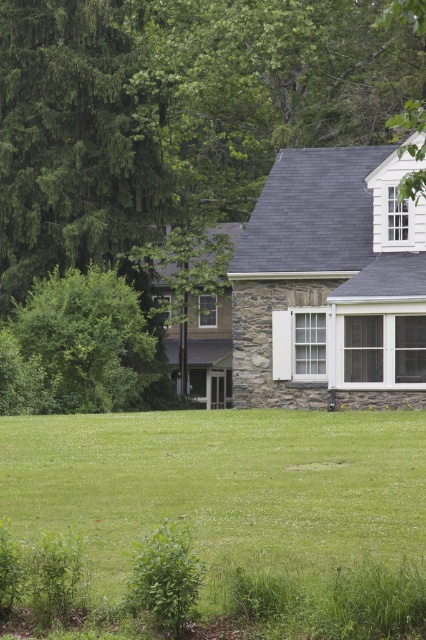
Who is higher up, green leafy tree at upper left or green grass at center?

green leafy tree at upper left is higher up.

Between point (238, 156) and point (284, 442), which one is positioned in front?

Point (284, 442) is in front.

Where is `green leafy tree at upper left`? This screenshot has height=640, width=426. green leafy tree at upper left is located at coordinates 173,118.

Is green leafy tree at upper left taller than green leafy bush at left?

Correct, green leafy tree at upper left is much taller as green leafy bush at left.

Which of these two, green leafy tree at upper left or green leafy bush at left, stands taller?

With more height is green leafy tree at upper left.

Is point (77, 99) farther from viewer compared to point (103, 275)?

Yes, it is behind point (103, 275).

Where is `green leafy tree at upper left`? Image resolution: width=426 pixels, height=640 pixels. green leafy tree at upper left is located at coordinates 173,118.

Is green grass at center wider than green leafy bush at left?

Yes, green grass at center is wider than green leafy bush at left.

Who is positioned more to the right, green grass at center or green leafy bush at left?

green grass at center

This screenshot has height=640, width=426. Describe the element at coordinates (235, 502) in the screenshot. I see `green grass at center` at that location.

Identify the location of green grass at center. Image resolution: width=426 pixels, height=640 pixels. (235, 502).